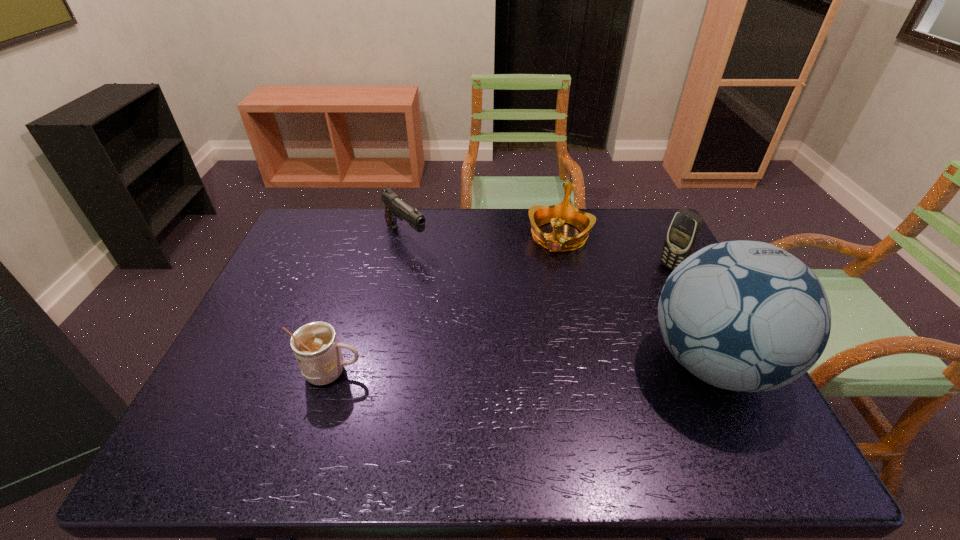
This screenshot has width=960, height=540. I want to click on vacant space on the desktop that is between the cup and the soccer ball and is positioned on the front face of the cellular telephone, so click(511, 368).

Locate an element on the screen. Image resolution: width=960 pixels, height=540 pixels. vacant spot on the desktop that is between the cup and the tallest object and is positioned in the direction the gun is aimed is located at coordinates (558, 367).

Locate an element on the screen. Image resolution: width=960 pixels, height=540 pixels. vacant space on the desktop that is between the cup and the soccer ball and is positioned at the front emblem of the tiara is located at coordinates (519, 368).